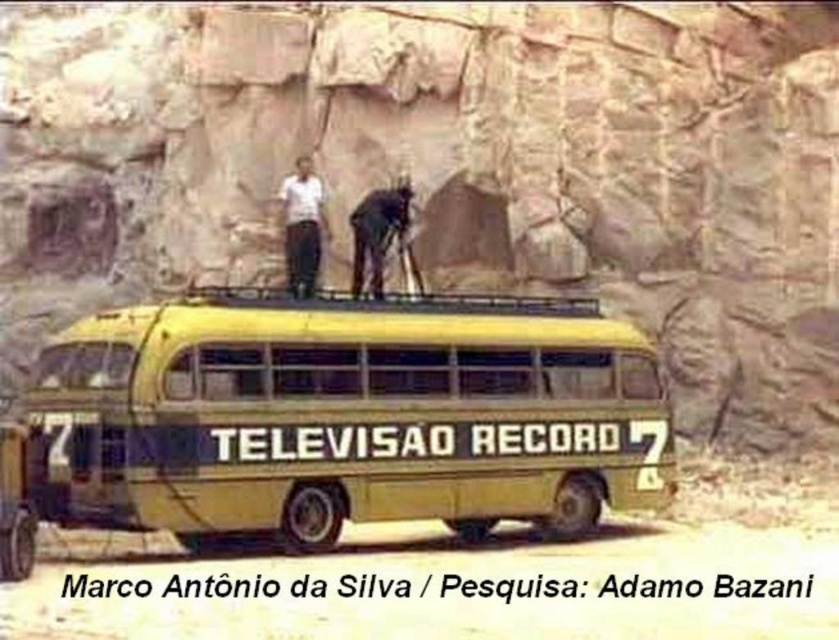
Who is lower down, yellow matte bus at center or white matte shirt at upper center?

yellow matte bus at center is below.

Is yellow matte bus at center positioned behind white matte shirt at upper center?

No, yellow matte bus at center is closer to the viewer.

Which is behind, point (159, 525) or point (305, 198)?

The point (305, 198) is behind.

Identify the location of yellow matte bus at center. (347, 413).

Measure the distance between point (748,204) and camera.

Point (748,204) and camera are 55.33 meters apart from each other.

Is point (494, 147) farther from viewer compared to point (50, 417)?

Yes, it is.

Which is behind, point (558, 268) or point (535, 298)?

Point (535, 298)

This screenshot has height=640, width=839. Find the location of `rough stone wall at upper center`. rough stone wall at upper center is located at coordinates (452, 168).

Who is taller, rough stone wall at upper center or white matte shirt at upper center?

rough stone wall at upper center

Which is in front, point (711, 132) or point (285, 262)?

Point (711, 132)

Is point (709, 275) positioned before point (298, 284)?

No, it is not.

Find the location of a particular element. This screenshot has width=839, height=640. rough stone wall at upper center is located at coordinates (452, 168).